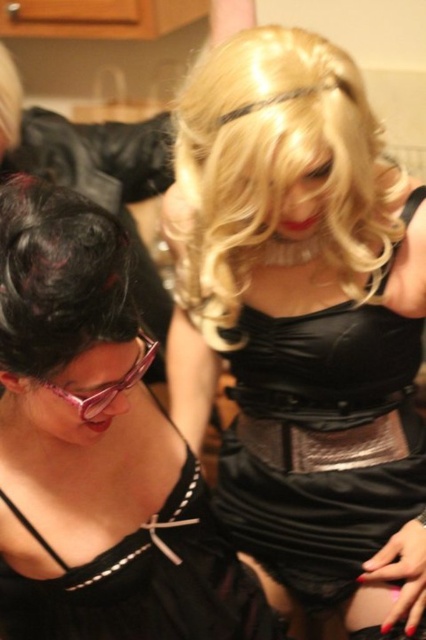
Is point (158, 568) positioned before point (25, 304)?

No, it is not.

Between point (227, 572) and point (89, 278), which one is positioned in front?

Point (89, 278) is more forward.

What are the coordinates of `satin black dress at center` in the screenshot? It's located at (97, 451).

Which is more to the left, satin black dress at center or blondehair at upper center?

From the viewer's perspective, satin black dress at center appears more on the left side.

Can you confirm if satin black dress at center is shorter than blondehair at upper center?

Incorrect, satin black dress at center's height does not fall short of blondehair at upper center's.

Does point (88, 602) come behind point (267, 97)?

Yes, it is.

Where is `satin black dress at center`? satin black dress at center is located at coordinates click(x=97, y=451).

Is shiny black hair at lower left positioned at the back of pink plastic goggles at lower left?

No, it is not.

Is shiny black hair at lower left taller than pink plastic goggles at lower left?

Correct, shiny black hair at lower left is much taller as pink plastic goggles at lower left.

Image resolution: width=426 pixels, height=640 pixels. Describe the element at coordinates (58, 276) in the screenshot. I see `shiny black hair at lower left` at that location.

This screenshot has width=426, height=640. I want to click on shiny black hair at lower left, so click(x=58, y=276).